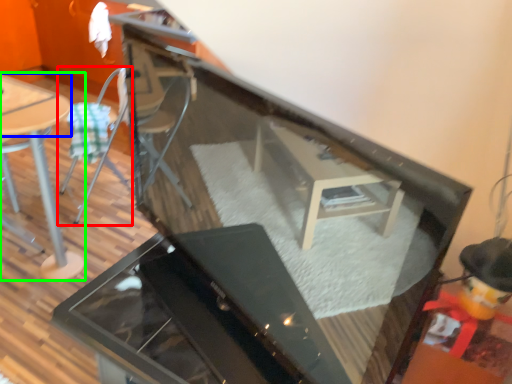
Question: Which object is the farthest from chair (highlighted by a red box)? Choose among these: table top (highlighted by a blue box) or table (highlighted by a green box).

Choices:
 (A) table top
 (B) table

Answer: (B)